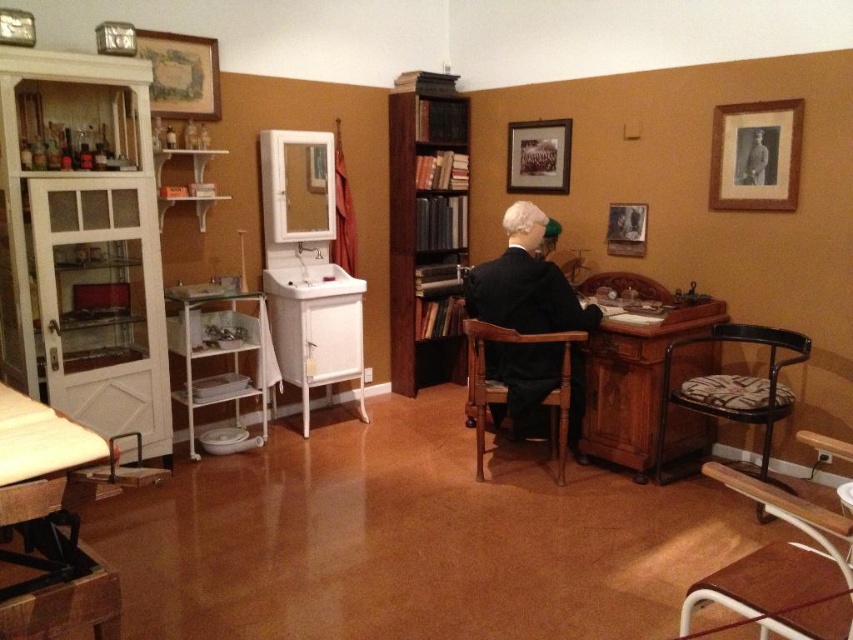
You are standing in the room and want to see both the brown wooden bookshelf at center and the uniformed man at center. Can you see both at the same time without moving your head?

The uniformed man at center is behind the brown wooden bookshelf at center, so you cannot see both at the same time without moving your head.

You are a tailor who needs to determine which clothing item requires more fabric between the black matte suit at center and the uniformed man at center. Based on the scene, which one would need more fabric?

The black matte suit at center has a larger size compared to uniformed man at center, so it would require more fabric.

You are standing at the entrance of the room and want to place a 12 feet long banner between the wooden picture frame at upper center and the desk. Is there enough space?

The distance between the wooden picture frame at upper center and the desk is 14.10 feet. Since the banner is 12 feet long, there is enough space to place it between them.